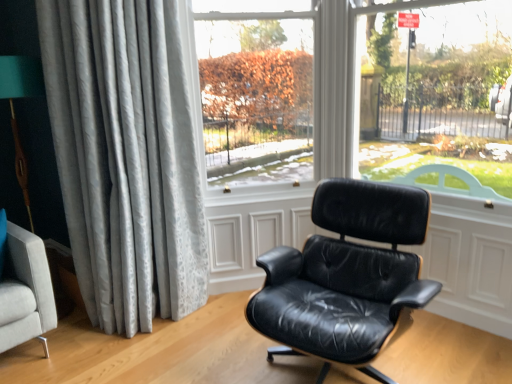
Question: Is silvery textured curtain at left to the left of transparent glass window at center from the viewer's perspective?

Choices:
 (A) no
 (B) yes

Answer: (B)

Question: From a real-world perspective, is silvery textured curtain at left located beneath transparent glass window at center?

Choices:
 (A) no
 (B) yes

Answer: (B)

Question: Does silvery textured curtain at left appear on the right side of transparent glass window at center?

Choices:
 (A) no
 (B) yes

Answer: (A)

Question: From the image's perspective, is silvery textured curtain at left located beneath transparent glass window at center?

Choices:
 (A) no
 (B) yes

Answer: (B)

Question: Is silvery textured curtain at left taller than transparent glass window at center?

Choices:
 (A) no
 (B) yes

Answer: (B)

Question: Considering the relative sizes of silvery textured curtain at left and transparent glass window at center in the image provided, is silvery textured curtain at left bigger than transparent glass window at center?

Choices:
 (A) yes
 (B) no

Answer: (A)

Question: Considering the relative sizes of silvery textured curtain at left and black leather chair at center in the image provided, is silvery textured curtain at left smaller than black leather chair at center?

Choices:
 (A) no
 (B) yes

Answer: (A)

Question: From the image's perspective, is silvery textured curtain at left over black leather chair at center?

Choices:
 (A) no
 (B) yes

Answer: (B)

Question: Is silvery textured curtain at left facing away from black leather chair at center?

Choices:
 (A) yes
 (B) no

Answer: (B)

Question: Can you confirm if silvery textured curtain at left is positioned to the left of black leather chair at center?

Choices:
 (A) yes
 (B) no

Answer: (A)

Question: Considering the relative sizes of silvery textured curtain at left and black leather chair at center in the image provided, is silvery textured curtain at left shorter than black leather chair at center?

Choices:
 (A) no
 (B) yes

Answer: (A)

Question: Is silvery textured curtain at left taller than black leather chair at center?

Choices:
 (A) yes
 (B) no

Answer: (A)

Question: Can you confirm if transparent glass window at center is taller than black leather chair at center?

Choices:
 (A) no
 (B) yes

Answer: (B)